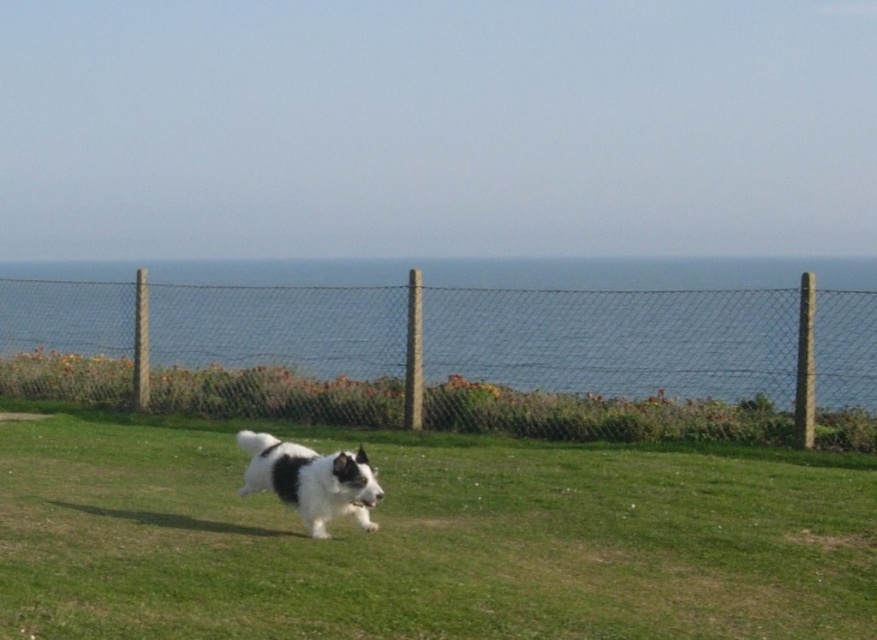
Is green grass at center taller than black-and-white fur dog at center?

No.

Is point (211, 541) farther from viewer compared to point (304, 484)?

No, it is in front of (304, 484).

Locate an element on the screen. green grass at center is located at coordinates (426, 540).

Who is positioned more to the left, green grass at center or wire mesh fence at center?

Positioned to the left is green grass at center.

Consider the image. Which of these two, green grass at center or wire mesh fence at center, stands shorter?

green grass at center

You are a GUI agent. You are given a task and a screenshot of the screen. Output one action in this format:
    pyautogui.click(x=<x>, y=<y>)
    Task: Click on the green grass at center
    This screenshot has width=877, height=640.
    Given the screenshot: What is the action you would take?
    pos(426,540)

Looking at this image, between wire mesh fence at center and black-and-white fur dog at center, which one has more height?

wire mesh fence at center

Measure the distance between wire mesh fence at center and camera.

wire mesh fence at center is 13.39 meters from camera.

Who is more forward, (804, 278) or (373, 525)?

Positioned in front is point (373, 525).

Locate an element on the screen. wire mesh fence at center is located at coordinates [476, 333].